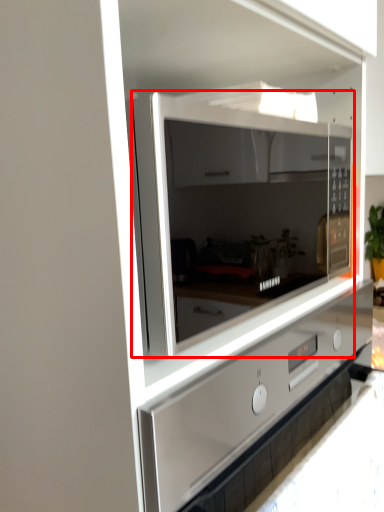
Question: From the image's perspective, what is the correct spatial relationship of microwave oven (annotated by the red box) in relation to home appliance?

Choices:
 (A) above
 (B) below

Answer: (A)